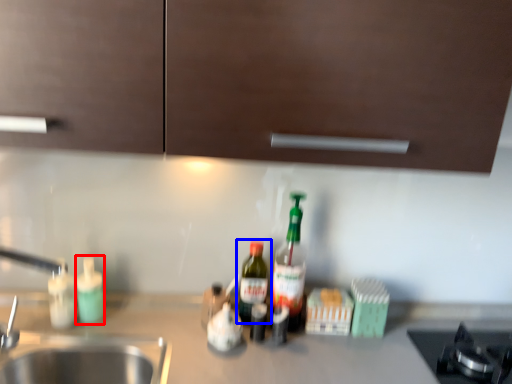
Question: Which object is closer to the camera taking this photo, bottle (highlighted by a red box) or bottle (highlighted by a blue box)?

Choices:
 (A) bottle
 (B) bottle

Answer: (A)